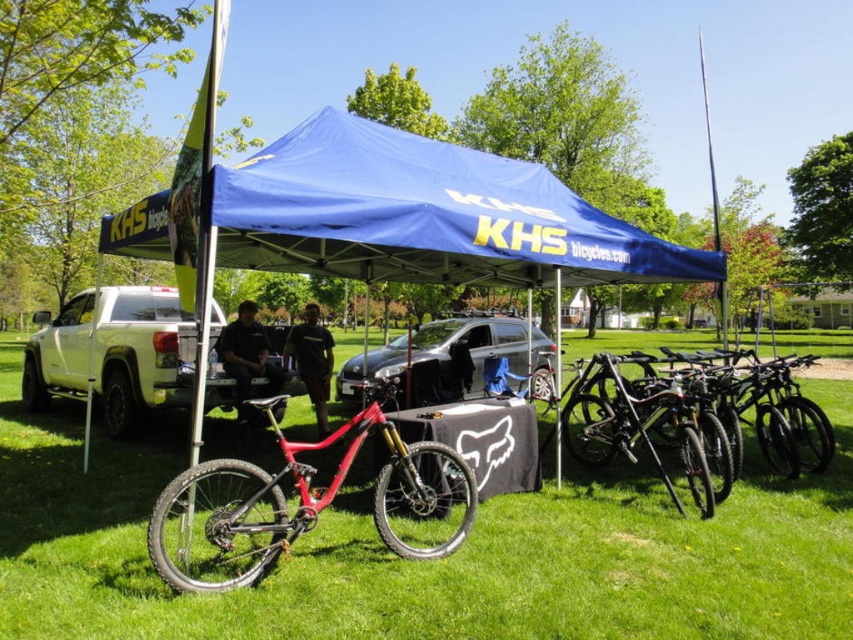
You are standing at the edge of the event area and want to place a new promotional banner on the ground at the exact center of the green grass at center. According to the coordinates provided, where should you place the banner?

You should place the banner at point (x=433, y=561) on the green grass at center as specified in the coordinates.

You are a photographer trying to capture the entire event setup. You notice the green grass at center and the blue fabric canopy at center. Which one is taller in the image?

The green grass at center is taller than the blue fabric canopy at center.